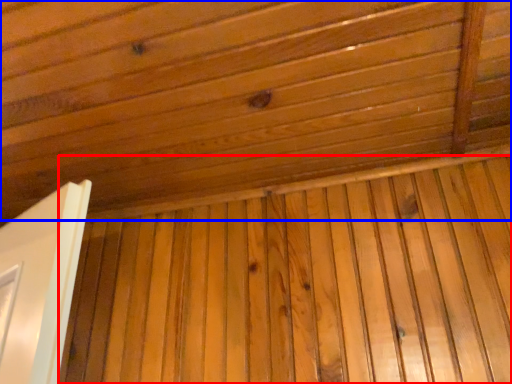
Question: Which point is closer to the camera, plywood (highlighted by a red box) or roof (highlighted by a blue box)?

Choices:
 (A) plywood
 (B) roof

Answer: (B)